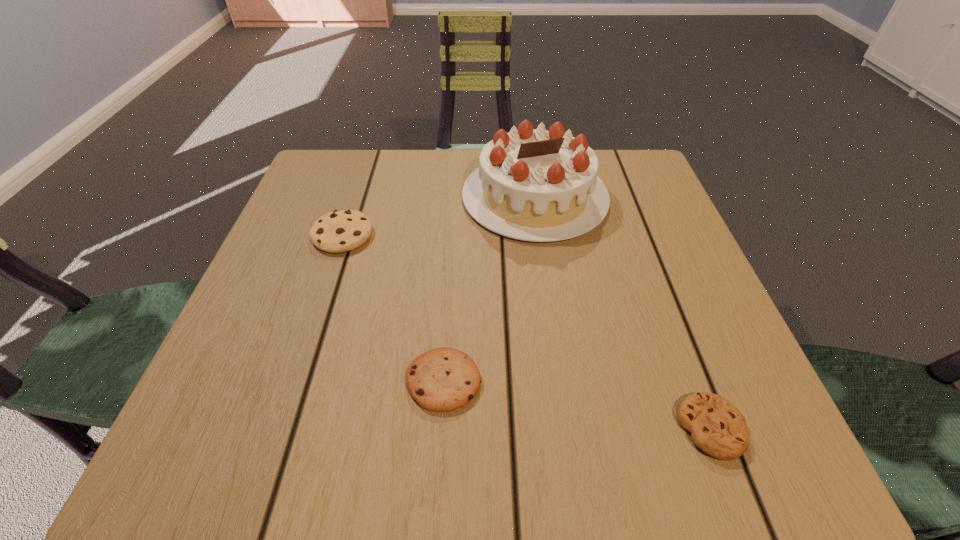
Where is `vacant region located 0.240m on the left of the rightmost cookie`? This screenshot has width=960, height=540. vacant region located 0.240m on the left of the rightmost cookie is located at coordinates (499, 428).

The height and width of the screenshot is (540, 960). I want to click on object that is at the far edge, so click(x=536, y=185).

This screenshot has height=540, width=960. Find the location of `object located at the left edge`. object located at the left edge is located at coordinates (339, 231).

Locate an element on the screen. The image size is (960, 540). birthday cake that is positioned at the right edge is located at coordinates click(x=536, y=185).

You are a GUI agent. You are given a task and a screenshot of the screen. Output one action in this format:
    pyautogui.click(x=<x>, y=<y>)
    Task: Click on the cookie that is at the right edge
    The height and width of the screenshot is (540, 960).
    Given the screenshot: What is the action you would take?
    pos(717,427)

The height and width of the screenshot is (540, 960). What are the coordinates of `object present at the far right corner` in the screenshot? It's located at (536, 185).

Locate an element on the screen. object present at the near right corner is located at coordinates (717, 427).

The height and width of the screenshot is (540, 960). I want to click on vacant space at the far edge of the desktop, so click(x=398, y=185).

In the image, there is a desktop. Find the location of `blank space at the near edge`. blank space at the near edge is located at coordinates (304, 464).

Locate an element on the screen. vacant space at the left edge is located at coordinates (238, 338).